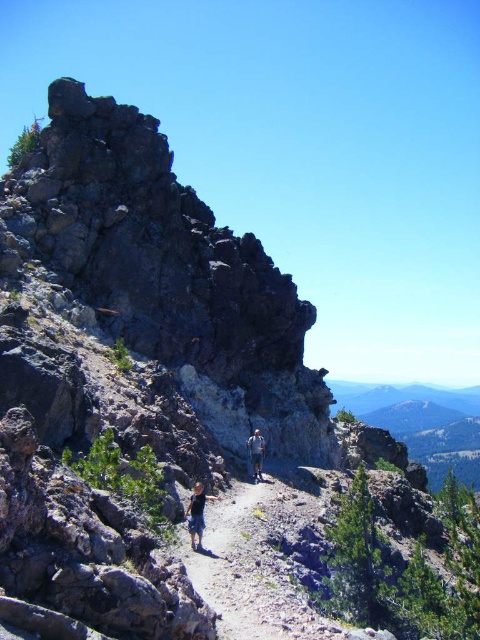
Is dark blue shorts at center below blue denim shorts at center?

No, dark blue shorts at center is not below blue denim shorts at center.

Who is more forward, (201, 499) or (259, 472)?

Point (201, 499) is more forward.

I want to click on dark blue shorts at center, so click(x=196, y=513).

You are a GUI agent. You are given a task and a screenshot of the screen. Output one action in this format:
    pyautogui.click(x=<x>, y=<y>)
    Task: Click on the dark blue shorts at center
    This screenshot has height=640, width=480.
    Given the screenshot: What is the action you would take?
    pyautogui.click(x=196, y=513)